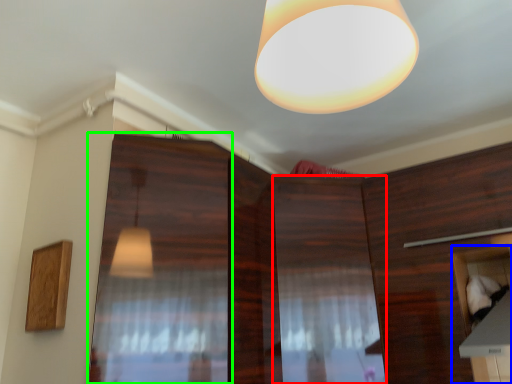
Question: Based on their relative distances, which object is nearer to cabinetry (highlighted by a red box)? Choose from cabinetry (highlighted by a blue box) and screen door (highlighted by a green box).

Choices:
 (A) cabinetry
 (B) screen door

Answer: (A)